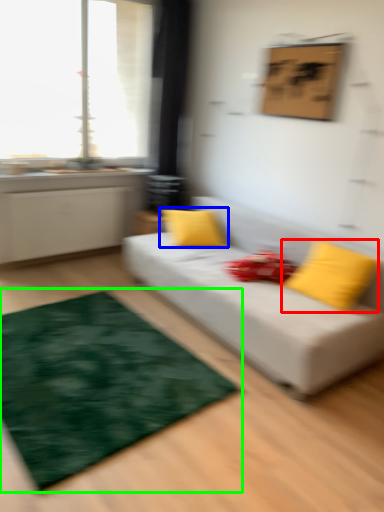
Question: Which object is positioned closest to pillow (highlighted by a red box)? Select from pillow (highlighted by a blue box) and mat (highlighted by a green box).

Choices:
 (A) pillow
 (B) mat

Answer: (A)